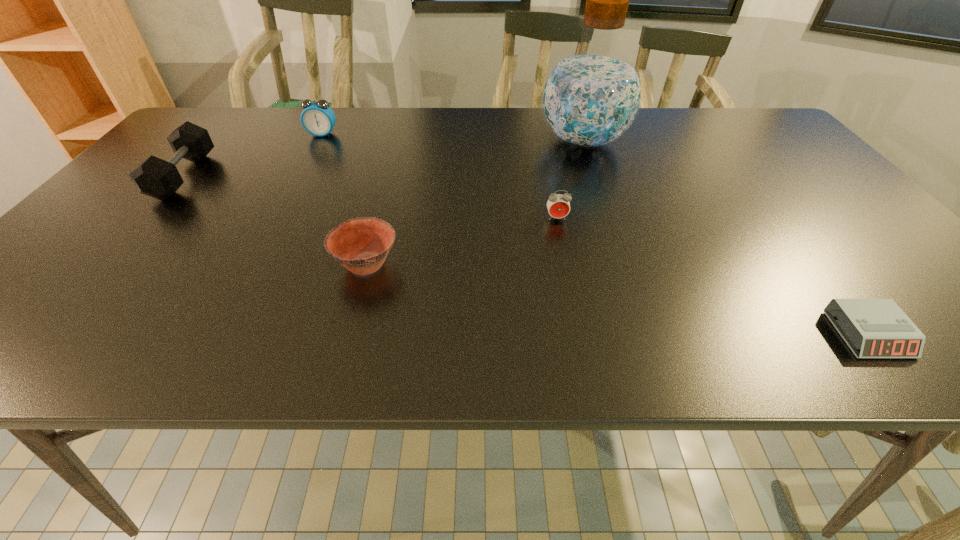
In order to click on object positioned at the right edge in this screenshot , I will do `click(878, 328)`.

Find the location of a particular element. object situated at the near right corner is located at coordinates (878, 328).

This screenshot has width=960, height=540. In order to click on vacant space at the far edge of the desktop in this screenshot , I will do `click(639, 114)`.

In the image, there is a desktop. Find the location of `free region at the near edge`. free region at the near edge is located at coordinates (667, 336).

In the image, there is a desktop. Where is `free space at the left edge`? This screenshot has height=540, width=960. free space at the left edge is located at coordinates (80, 306).

The height and width of the screenshot is (540, 960). In order to click on free space at the right edge of the desktop in this screenshot , I will do `click(845, 216)`.

In the image, there is a desktop. Identify the location of vacant space at the far right corner. (782, 144).

This screenshot has width=960, height=540. Find the location of `free space between the second object from left to right and the third object from left to right`. free space between the second object from left to right and the third object from left to right is located at coordinates (345, 199).

What are the coordinates of `free space between the water jug and the bowl` in the screenshot? It's located at (475, 203).

The height and width of the screenshot is (540, 960). Find the location of `vacant space that is in between the bowl and the shortest alarm clock`. vacant space that is in between the bowl and the shortest alarm clock is located at coordinates (617, 299).